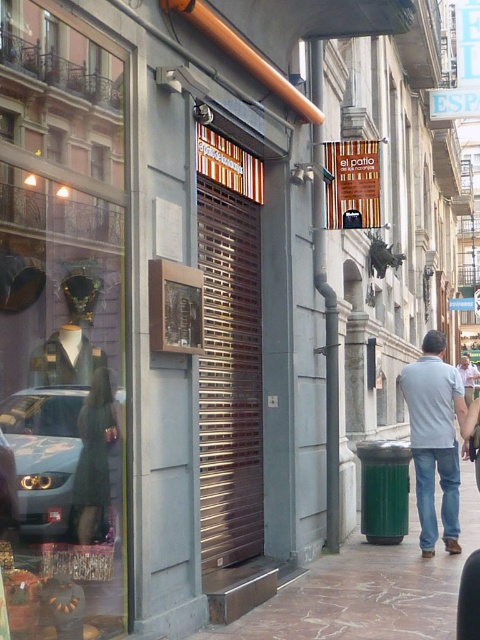
In the scene shown: Does brown marble pavement at lower right have a lesser width compared to silver metallic car at lower left?

In fact, brown marble pavement at lower right might be wider than silver metallic car at lower left.

Does point (283, 609) come behind point (43, 461)?

Yes.

Is point (332, 600) farther from camera compared to point (71, 438)?

Yes, point (332, 600) is farther from viewer.

At what (x,y) coordinates should I click in order to perform the action: click on brown marble pavement at lower right. Please return your answer as a coordinate pair (x, y). This screenshot has height=640, width=480. Looking at the image, I should click on (369, 588).

Describe the element at coordinates (369, 588) in the screenshot. I see `brown marble pavement at lower right` at that location.

Who is lower down, brown marble pavement at lower right or blue denim jeans at lower right?

brown marble pavement at lower right is below.

I want to click on brown marble pavement at lower right, so click(369, 588).

This screenshot has height=640, width=480. Find the location of `brown marble pavement at lower right`. brown marble pavement at lower right is located at coordinates (369, 588).

Does brown marble pavement at lower right appear under light gray denim jeans at center?

Yes.

Does brown marble pavement at lower right have a lesser height compared to light gray denim jeans at center?

Indeed, brown marble pavement at lower right has a lesser height compared to light gray denim jeans at center.

Who is more forward, (436, 573) or (454, 538)?

Positioned in front is point (436, 573).

Identify the location of brown marble pavement at lower right. (369, 588).